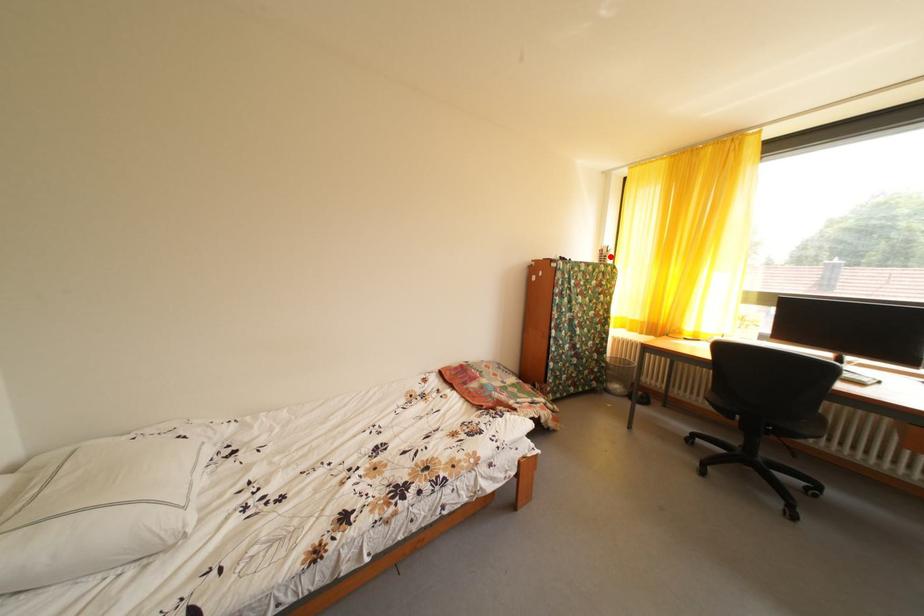
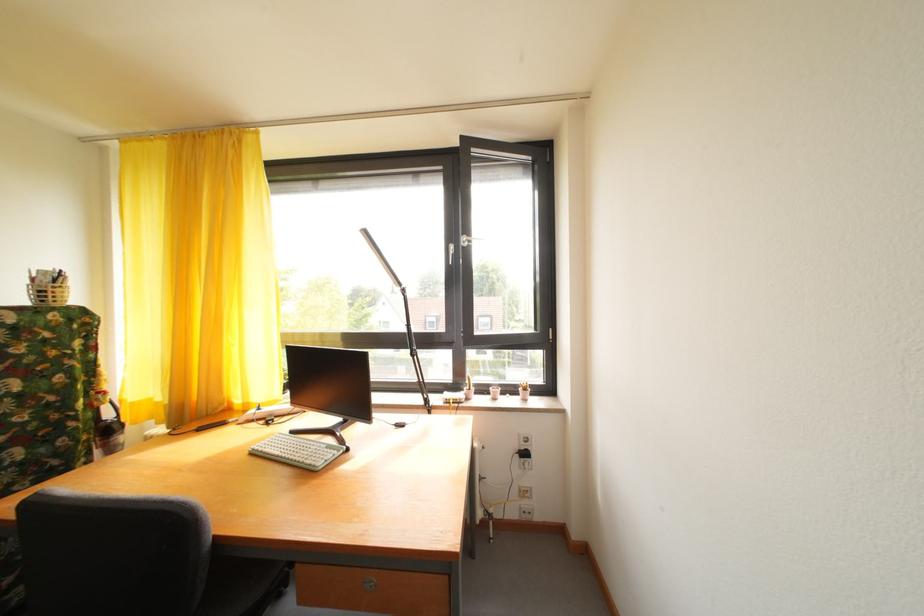
Question: I am providing you with two images of the same scene from different viewpoints. A red point is marked on the first image. Can you still see the location of the red point in image 2?

Choices:
 (A) Yes
 (B) No

Answer: (A)